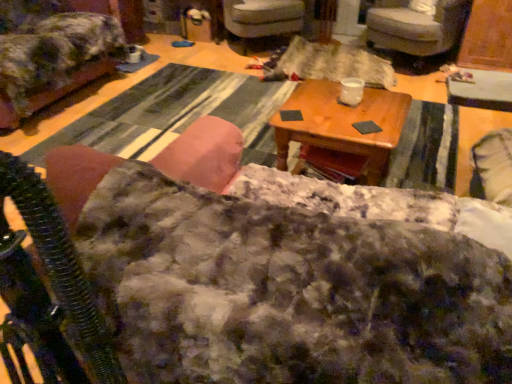
Question: Can you confirm if velvet gray armchair at upper right, which is the 1th chair from right to left, is smaller than velvet gray armchair at center, which is the 2th chair in right-to-left order?

Choices:
 (A) no
 (B) yes

Answer: (A)

Question: Considering the relative sizes of velvet gray armchair at upper right, which is the 1th chair from right to left, and velvet gray armchair at center, which is the 2th chair in right-to-left order, in the image provided, is velvet gray armchair at upper right, which is the 1th chair from right to left, bigger than velvet gray armchair at center, which is the 2th chair in right-to-left order,?

Choices:
 (A) no
 (B) yes

Answer: (B)

Question: From a real-world perspective, is velvet gray armchair at upper right, which is the 1th chair from right to left, under velvet gray armchair at center, which is the 2th chair in right-to-left order?

Choices:
 (A) yes
 (B) no

Answer: (B)

Question: Does velvet gray armchair at upper right, placed as the third chair when sorted from left to right, have a lesser width compared to velvet gray armchair at center, positioned as the second chair in left-to-right order?

Choices:
 (A) no
 (B) yes

Answer: (A)

Question: Could you tell me if velvet gray armchair at upper right, placed as the third chair when sorted from left to right, is turned towards velvet gray armchair at center, positioned as the second chair in left-to-right order?

Choices:
 (A) no
 (B) yes

Answer: (A)

Question: From a real-world perspective, is fuzzy fabric rocking chair at left above or below velvet gray armchair at upper right, which is the 1th chair from right to left?

Choices:
 (A) below
 (B) above

Answer: (B)

Question: Considering the positions of fuzzy fabric rocking chair at left and velvet gray armchair at upper right, which is the 1th chair from right to left, in the image, is fuzzy fabric rocking chair at left wider or thinner than velvet gray armchair at upper right, which is the 1th chair from right to left,?

Choices:
 (A) thin
 (B) wide

Answer: (A)

Question: From the image's perspective, is fuzzy fabric rocking chair at left located above or below velvet gray armchair at upper right, which is the 1th chair from right to left?

Choices:
 (A) above
 (B) below

Answer: (B)

Question: Based on their sizes in the image, would you say fuzzy fabric rocking chair at left is bigger or smaller than velvet gray armchair at upper right, which is the 1th chair from right to left?

Choices:
 (A) small
 (B) big

Answer: (A)

Question: Considering their positions, is fluffy fabric couch at center located in front of or behind velvet gray armchair at upper right, which is the 1th chair from right to left?

Choices:
 (A) front
 (B) behind

Answer: (A)

Question: From a real-world perspective, is fluffy fabric couch at center physically located above or below velvet gray armchair at upper right, placed as the third chair when sorted from left to right?

Choices:
 (A) above
 (B) below

Answer: (A)

Question: From their relative heights in the image, would you say fluffy fabric couch at center is taller or shorter than velvet gray armchair at upper right, placed as the third chair when sorted from left to right?

Choices:
 (A) short
 (B) tall

Answer: (B)

Question: Is fluffy fabric couch at center inside or outside of velvet gray armchair at upper right, placed as the third chair when sorted from left to right?

Choices:
 (A) outside
 (B) inside

Answer: (A)

Question: From a real-world perspective, is velvet gray armchair at upper right, placed as the third chair when sorted from left to right, physically located above or below wooden table at center?

Choices:
 (A) above
 (B) below

Answer: (A)

Question: Do you think velvet gray armchair at upper right, placed as the third chair when sorted from left to right, is within wooden table at center, or outside of it?

Choices:
 (A) inside
 (B) outside

Answer: (B)